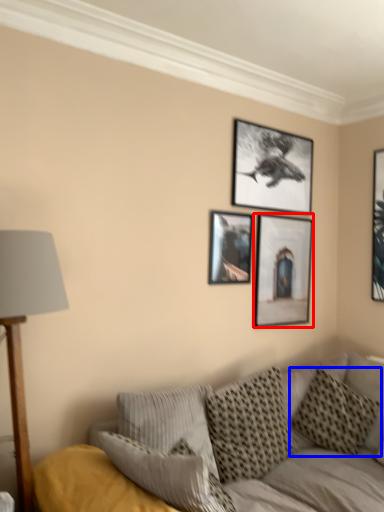
Question: Which point is closer to the camera, picture frame (highlighted by a red box) or pillow (highlighted by a blue box)?

Choices:
 (A) picture frame
 (B) pillow

Answer: (B)